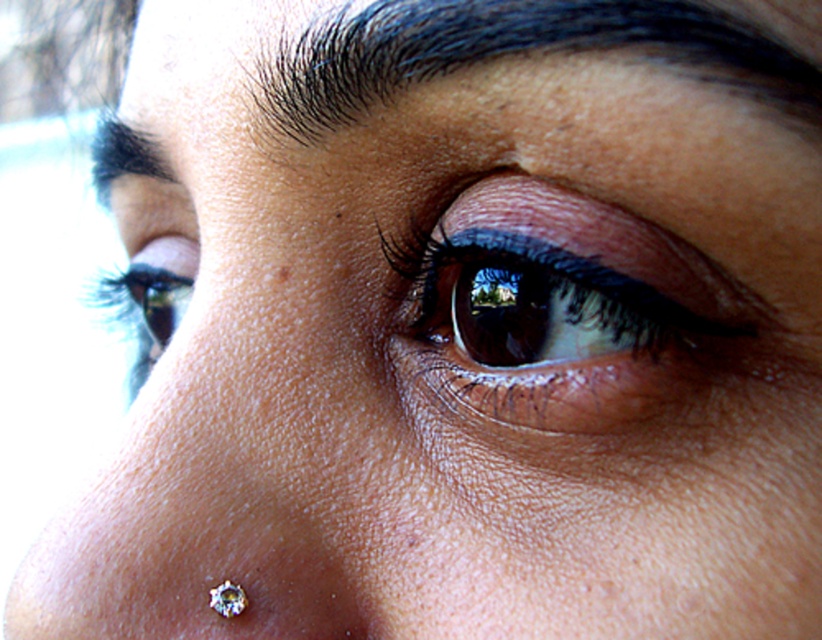
Question: Which object is closer to the camera taking this photo?

Choices:
 (A) brown matte eye at center
 (B) dark blue hair at upper center

Answer: (B)

Question: Which object appears farthest from the camera in this image?

Choices:
 (A) brown matte eye at center
 (B) matte black eye at upper left

Answer: (B)

Question: Is brown matte eye at center to the left of dark brown hair at upper left from the viewer's perspective?

Choices:
 (A) no
 (B) yes

Answer: (A)

Question: Which point is closer to the camera?

Choices:
 (A) (719, 52)
 (B) (165, 246)
 (C) (492, 413)

Answer: (A)

Question: Can you confirm if dark blue hair at upper center is positioned to the left of clear crystal earring at lower center?

Choices:
 (A) yes
 (B) no

Answer: (B)

Question: Does brown matte eye at center have a smaller size compared to matte black eye at upper left?

Choices:
 (A) yes
 (B) no

Answer: (A)